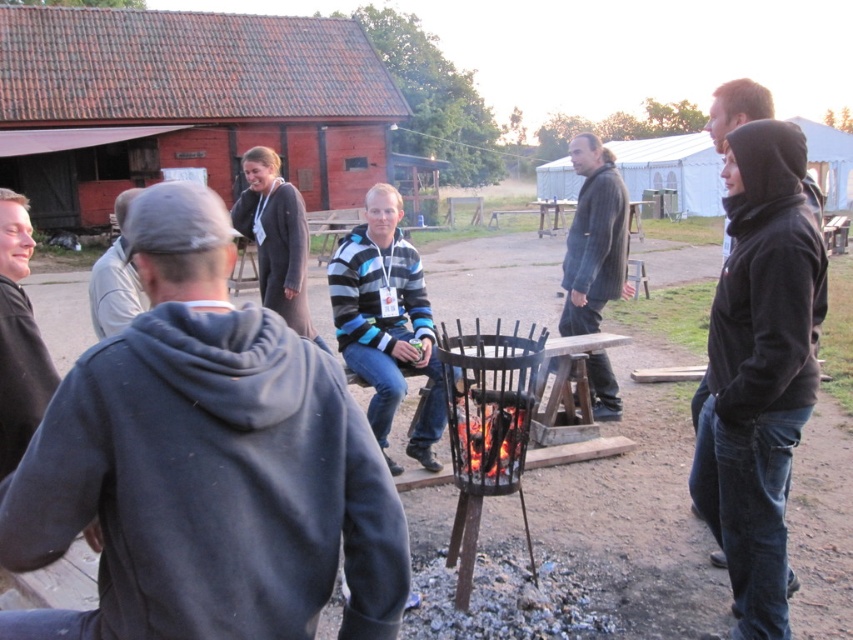
Question: From the image, what is the correct spatial relationship of striped sweater at center in relation to dark gray sweater at center?

Choices:
 (A) above
 (B) below

Answer: (B)

Question: Is dark gray hoodie at center positioned at the back of striped sweater at center?

Choices:
 (A) yes
 (B) no

Answer: (B)

Question: Is dark gray hoodie at center positioned before black fleece jacket at right?

Choices:
 (A) yes
 (B) no

Answer: (A)

Question: Considering the real-world distances, which object is farthest from the gray hoodie at center?

Choices:
 (A) striped sweater at center
 (B) dark gray hoodie at center
 (C) black fleece jacket at right
 (D) dark gray sweater at center

Answer: (C)

Question: Which object is the farthest from the dark gray sweater at center?

Choices:
 (A) striped sweater at center
 (B) dark gray hoodie at center

Answer: (B)

Question: Which point appears closest to the camera in this image?

Choices:
 (A) (102, 305)
 (B) (590, 278)
 (C) (399, 358)

Answer: (A)